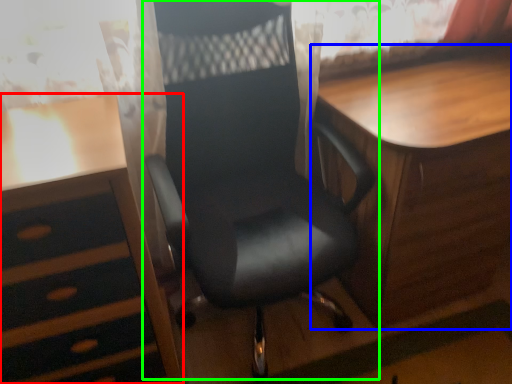
Question: Based on their relative distances, which object is nearer to desk (highlighted by a red box)? Choose from table (highlighted by a blue box) and chair (highlighted by a green box).

Choices:
 (A) table
 (B) chair

Answer: (B)